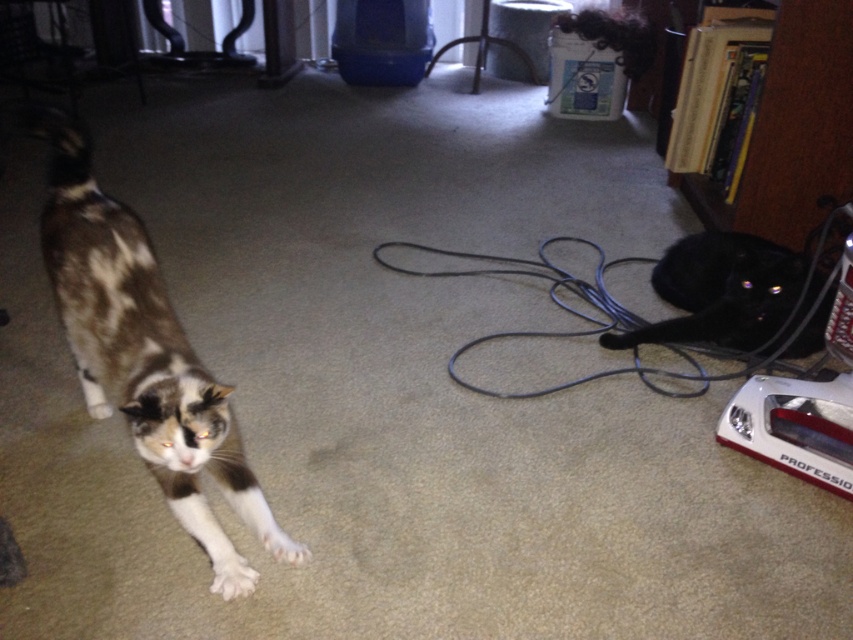
Is point (646, 332) closer to viewer compared to point (218, 589)?

No.

Who is positioned more to the right, black glossy cat at lower right or white soft paw at lower left?

black glossy cat at lower right

At what (x,y) coordinates should I click in order to perform the action: click on black glossy cat at lower right. Please return your answer as a coordinate pair (x, y). This screenshot has width=853, height=640. Looking at the image, I should click on (720, 291).

Is calico fur cat at left bigger than white soft paw at lower left?

Yes, calico fur cat at left is bigger than white soft paw at lower left.

In the scene shown: Is calico fur cat at left below white soft paw at lower left?

Incorrect, calico fur cat at left is not positioned below white soft paw at lower left.

What are the coordinates of `calico fur cat at left` in the screenshot? It's located at (136, 340).

This screenshot has height=640, width=853. What do you see at coordinates (136, 340) in the screenshot?
I see `calico fur cat at left` at bounding box center [136, 340].

Is point (201, 525) closer to camera compared to point (281, 548)?

That is False.

This screenshot has height=640, width=853. Find the location of `calico fur cat at left`. calico fur cat at left is located at coordinates (136, 340).